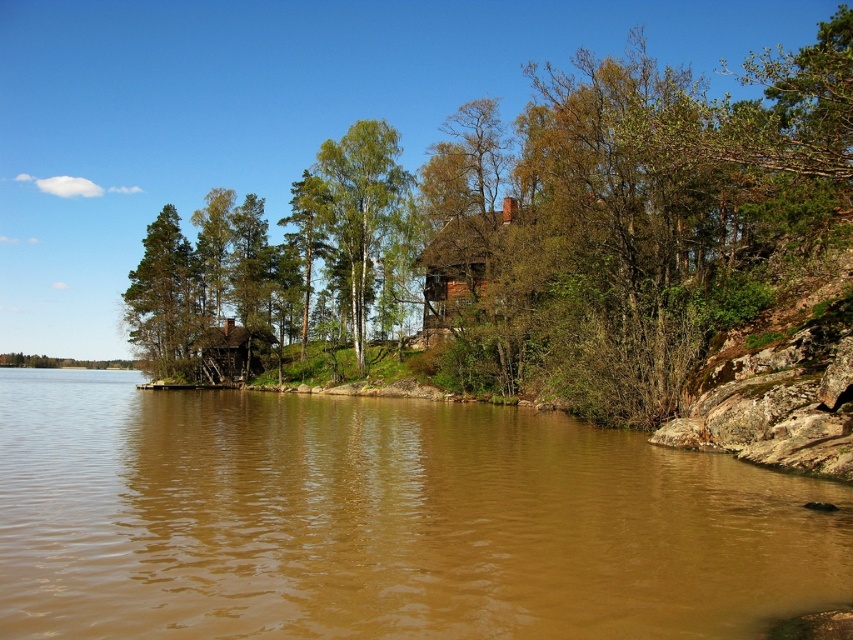
Question: Which object appears closest to the camera in this image?

Choices:
 (A) brown muddy water at lower left
 (B) green matte tree at center

Answer: (A)

Question: Which point appears closest to the camera in this image?

Choices:
 (A) (339, 186)
 (B) (807, 170)
 (C) (804, 531)
 (D) (146, 228)

Answer: (C)

Question: Is green leafy tree at center to the right of green matte tree at center from the viewer's perspective?

Choices:
 (A) no
 (B) yes

Answer: (B)

Question: Is green leafy tree at center above green matte tree at upper left?

Choices:
 (A) no
 (B) yes

Answer: (B)

Question: Does brown muddy water at lower left have a greater width compared to green leafy tree at center?

Choices:
 (A) yes
 (B) no

Answer: (B)

Question: Which of the following is the farthest from the observer?

Choices:
 (A) (416, 544)
 (B) (354, 282)
 (C) (432, 163)

Answer: (B)